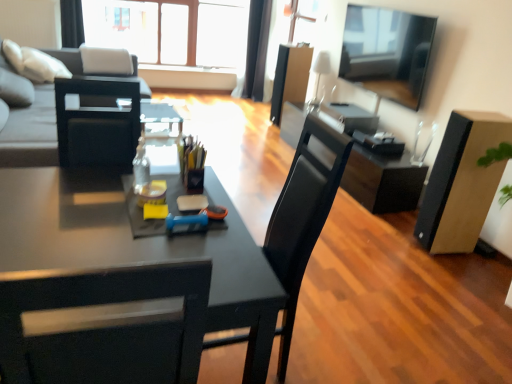
You are a GUI agent. You are given a task and a screenshot of the screen. Output one action in this format:
    pyautogui.click(x=<x>, y=<y>)
    Task: Click on the vacant area that lies to the right of translucent glass bottle at center
    
    Given the screenshot: What is the action you would take?
    pyautogui.click(x=183, y=191)